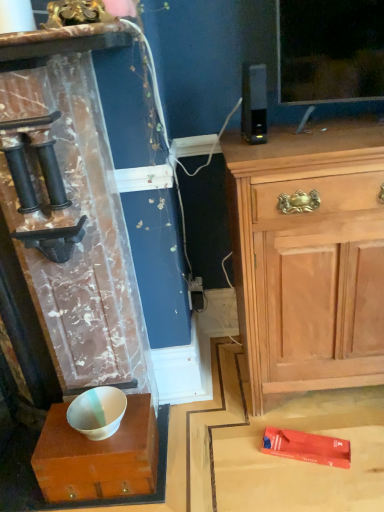
Question: From the image's perspective, is white glossy bowl at center located above white glossy bowl at lower left?

Choices:
 (A) no
 (B) yes

Answer: (A)

Question: Is white glossy bowl at center located outside white glossy bowl at lower left?

Choices:
 (A) yes
 (B) no

Answer: (A)

Question: From the image's perspective, would you say white glossy bowl at center is shown under white glossy bowl at lower left?

Choices:
 (A) yes
 (B) no

Answer: (A)

Question: Can you confirm if white glossy bowl at center is thinner than white glossy bowl at lower left?

Choices:
 (A) no
 (B) yes

Answer: (A)

Question: Considering the relative sizes of white glossy bowl at center and white glossy bowl at lower left in the image provided, is white glossy bowl at center bigger than white glossy bowl at lower left?

Choices:
 (A) no
 (B) yes

Answer: (B)

Question: Can you confirm if white glossy bowl at center is shorter than white glossy bowl at lower left?

Choices:
 (A) no
 (B) yes

Answer: (A)

Question: Is white glossy bowl at lower left thinner than light wood cabinet at upper right?

Choices:
 (A) yes
 (B) no

Answer: (A)

Question: Can you confirm if white glossy bowl at lower left is positioned to the right of light wood cabinet at upper right?

Choices:
 (A) no
 (B) yes

Answer: (A)

Question: Is white glossy bowl at lower left at the left side of light wood cabinet at upper right?

Choices:
 (A) yes
 (B) no

Answer: (A)

Question: Is white glossy bowl at lower left further to the viewer compared to light wood cabinet at upper right?

Choices:
 (A) yes
 (B) no

Answer: (A)

Question: Are white glossy bowl at lower left and light wood cabinet at upper right far apart?

Choices:
 (A) yes
 (B) no

Answer: (B)

Question: Is white glossy bowl at lower left outside light wood cabinet at upper right?

Choices:
 (A) yes
 (B) no

Answer: (A)

Question: Would you say light wood cabinet at upper right is part of white glossy bowl at center's contents?

Choices:
 (A) no
 (B) yes

Answer: (A)